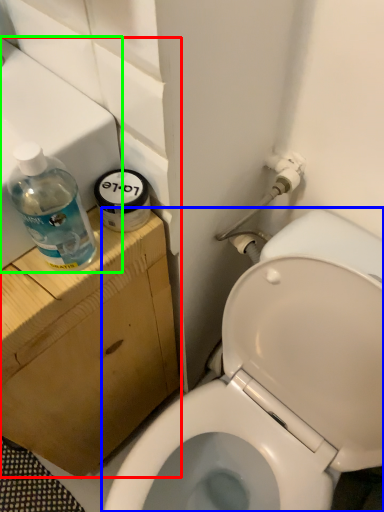
Question: Based on their relative distances, which object is farther from sink (highlighted by a red box)? Choose from toilet (highlighted by a blue box) and sink (highlighted by a green box).

Choices:
 (A) toilet
 (B) sink

Answer: (A)